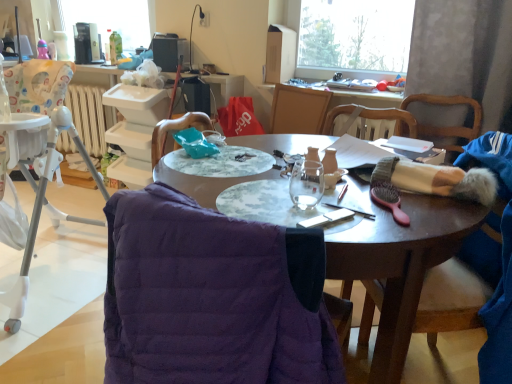
The height and width of the screenshot is (384, 512). What are the coordinates of `vacant area that lies to the right of black plastic pen at center` in the screenshot? It's located at (411, 211).